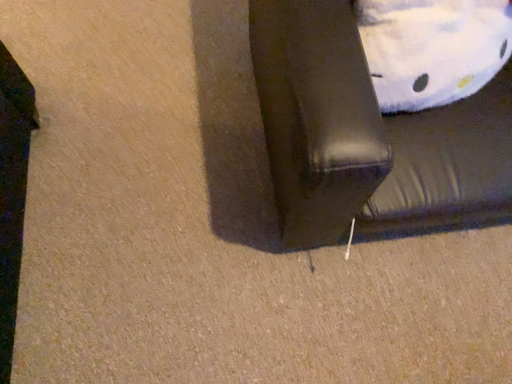
Question: Considering the positions of white plush pillow at upper right and black leather couch at lower right in the image, is white plush pillow at upper right bigger or smaller than black leather couch at lower right?

Choices:
 (A) small
 (B) big

Answer: (A)

Question: From the image's perspective, is white plush pillow at upper right above or below black leather couch at lower right?

Choices:
 (A) above
 (B) below

Answer: (A)

Question: From a real-world perspective, is white plush pillow at upper right above or below black leather couch at lower right?

Choices:
 (A) below
 (B) above

Answer: (B)

Question: Based on their sizes in the image, would you say black leather couch at lower right is bigger or smaller than white plush pillow at upper right?

Choices:
 (A) small
 (B) big

Answer: (B)

Question: From a real-world perspective, relative to white plush pillow at upper right, is black leather couch at lower right vertically above or below?

Choices:
 (A) above
 (B) below

Answer: (B)

Question: Is black leather couch at lower right taller or shorter than white plush pillow at upper right?

Choices:
 (A) tall
 (B) short

Answer: (A)

Question: Is black leather couch at lower right wider or thinner than white plush pillow at upper right?

Choices:
 (A) wide
 (B) thin

Answer: (A)